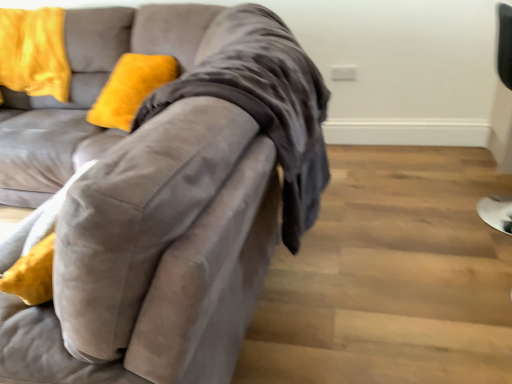
Question: Does velvet yellow pillow at upper left appear on the right side of black leather chair at right?

Choices:
 (A) yes
 (B) no

Answer: (B)

Question: Can you confirm if velvet yellow pillow at upper left is positioned to the left of black leather chair at right?

Choices:
 (A) yes
 (B) no

Answer: (A)

Question: Is velvet yellow pillow at upper left positioned before black leather chair at right?

Choices:
 (A) no
 (B) yes

Answer: (A)

Question: From a real-world perspective, is velvet yellow pillow at upper left physically below black leather chair at right?

Choices:
 (A) yes
 (B) no

Answer: (B)

Question: From a real-world perspective, is velvet yellow pillow at upper left physically above black leather chair at right?

Choices:
 (A) yes
 (B) no

Answer: (A)

Question: From a real-world perspective, is velvet gray couch at left above or below velvet yellow pillow at upper left?

Choices:
 (A) above
 (B) below

Answer: (B)

Question: From their relative heights in the image, would you say velvet gray couch at left is taller or shorter than velvet yellow pillow at upper left?

Choices:
 (A) tall
 (B) short

Answer: (A)

Question: Is point (143, 304) closer or farther from the camera than point (53, 39)?

Choices:
 (A) farther
 (B) closer

Answer: (B)

Question: Based on their positions, is velvet gray couch at left located to the left or right of velvet yellow pillow at upper left?

Choices:
 (A) right
 (B) left

Answer: (A)

Question: Is black leather chair at right bigger or smaller than velvet gray couch at left?

Choices:
 (A) big
 (B) small

Answer: (B)

Question: From the image's perspective, relative to velvet gray couch at left, is black leather chair at right above or below?

Choices:
 (A) above
 (B) below

Answer: (A)

Question: In terms of height, does black leather chair at right look taller or shorter compared to velvet gray couch at left?

Choices:
 (A) tall
 (B) short

Answer: (B)

Question: Does point (507, 46) appear closer or farther from the camera than point (202, 57)?

Choices:
 (A) closer
 (B) farther

Answer: (B)

Question: From a real-world perspective, is velvet gray couch at left physically located above or below black leather chair at right?

Choices:
 (A) above
 (B) below

Answer: (A)

Question: Would you say velvet gray couch at left is to the left or to the right of black leather chair at right in the picture?

Choices:
 (A) left
 (B) right

Answer: (A)